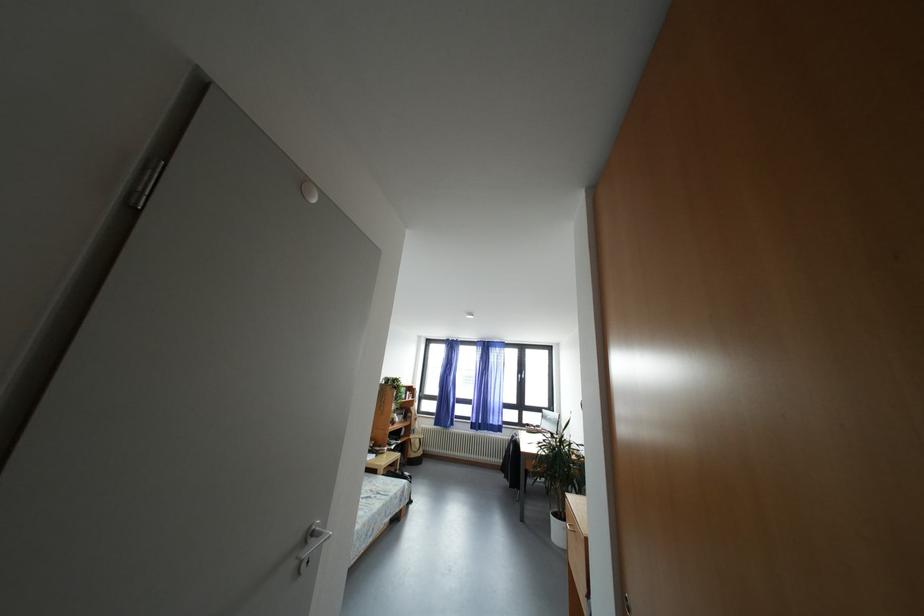
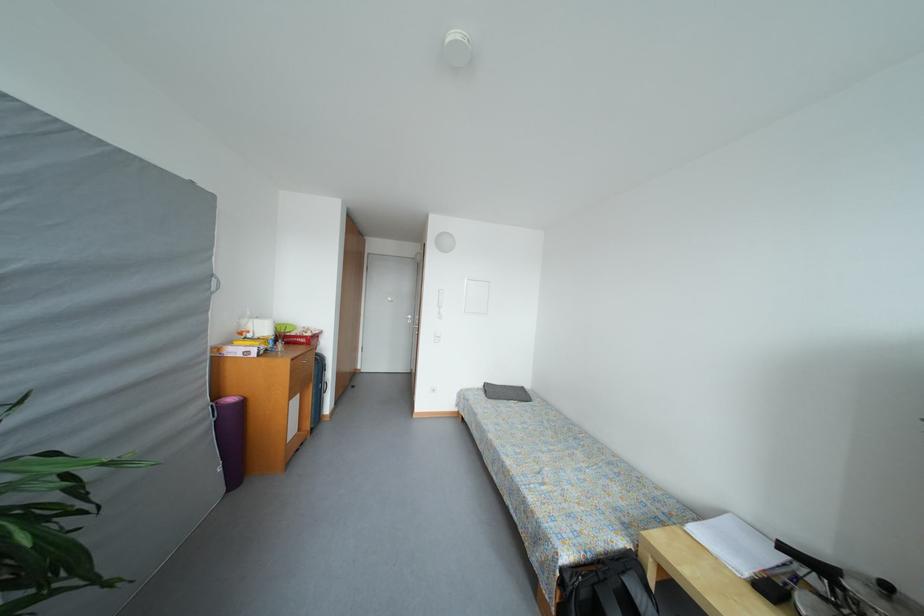
Question: I am providing you with two images of the same scene from different viewpoints. Which of the following objects are not visible in image2?

Choices:
 (A) intercom handset
 (B) small black trashcan
 (C) grey cushion
 (D) black window handle

Answer: (D)